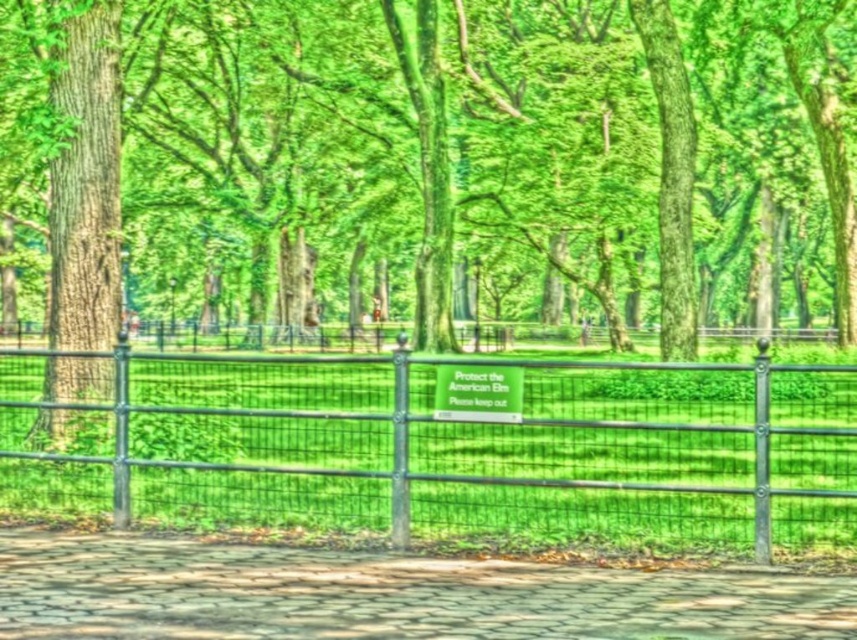
Does green leafy tree at center have a larger size compared to green wire mesh fence at center?

Correct, green leafy tree at center is larger in size than green wire mesh fence at center.

Does green leafy tree at center have a smaller size compared to green wire mesh fence at center?

Actually, green leafy tree at center might be larger than green wire mesh fence at center.

Does point (558, 13) come farther from viewer compared to point (616, 392)?

Yes, point (558, 13) is behind point (616, 392).

I want to click on green leafy tree at center, so click(x=435, y=163).

Is green wire mesh fence at center smaller than paved stone path at lower center?

Actually, green wire mesh fence at center might be larger than paved stone path at lower center.

In order to click on green wire mesh fence at center in this screenshot , I will do `click(464, 444)`.

Identify the location of green wire mesh fence at center. Image resolution: width=857 pixels, height=640 pixels. (464, 444).

Can you confirm if green leafy tree at center is smaller than paved stone path at lower center?

No, green leafy tree at center is not smaller than paved stone path at lower center.

Does green leafy tree at center appear on the left side of paved stone path at lower center?

Yes, green leafy tree at center is to the left of paved stone path at lower center.

Locate an element on the screen. The image size is (857, 640). green leafy tree at center is located at coordinates (435, 163).

Find the location of a particular element. This screenshot has width=857, height=640. green leafy tree at center is located at coordinates (435, 163).